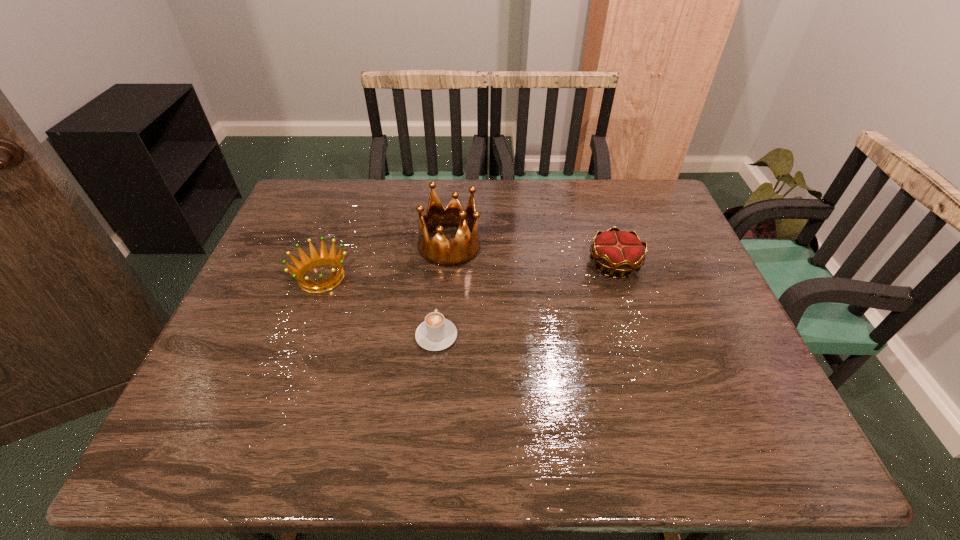
Select which crown appears as the closest to the rightmost object. Please provide its 2D coordinates. Your answer should be formatted as a tuple, i.e. [(x, y)], where the tuple contains the x and y coordinates of a point satisfying the conditions above.

[(439, 251)]

You are a GUI agent. You are given a task and a screenshot of the screen. Output one action in this format:
    pyautogui.click(x=<x>, y=<y>)
    Task: Click on the free space that satisfies the following two spatial constraints: 1. to the right of the nearest object; 2. on the right side of the second crown from left to right
    Image resolution: width=960 pixels, height=540 pixels.
    Given the screenshot: What is the action you would take?
    pyautogui.click(x=444, y=246)

At what (x,y) coordinates should I click in order to perform the action: click on vacant area in the image that satisfies the following two spatial constraints: 1. on the back side of the leftmost object; 2. on the left side of the tallest crown. Please return your answer as a coordinate pair (x, y). The height and width of the screenshot is (540, 960). Looking at the image, I should click on click(333, 246).

The height and width of the screenshot is (540, 960). In order to click on vacant space that satisfies the following two spatial constraints: 1. on the back side of the leftmost object; 2. on the left side of the rightmost object in this screenshot , I will do `click(326, 264)`.

Locate an element on the screen. The width and height of the screenshot is (960, 540). free location that satisfies the following two spatial constraints: 1. to the right of the shortest object; 2. on the left side of the rightmost crown is located at coordinates (443, 264).

The image size is (960, 540). I want to click on free space in the image that satisfies the following two spatial constraints: 1. to the right of the rightmost object; 2. on the right side of the cappuccino, so click(443, 264).

Find the location of a particular element. free region that satisfies the following two spatial constraints: 1. to the right of the tallest object; 2. on the left side of the shortest object is located at coordinates (444, 246).

Where is `vacant space that satisfies the following two spatial constraints: 1. to the right of the tallest object; 2. on the right side of the cappuccino`? vacant space that satisfies the following two spatial constraints: 1. to the right of the tallest object; 2. on the right side of the cappuccino is located at coordinates (444, 246).